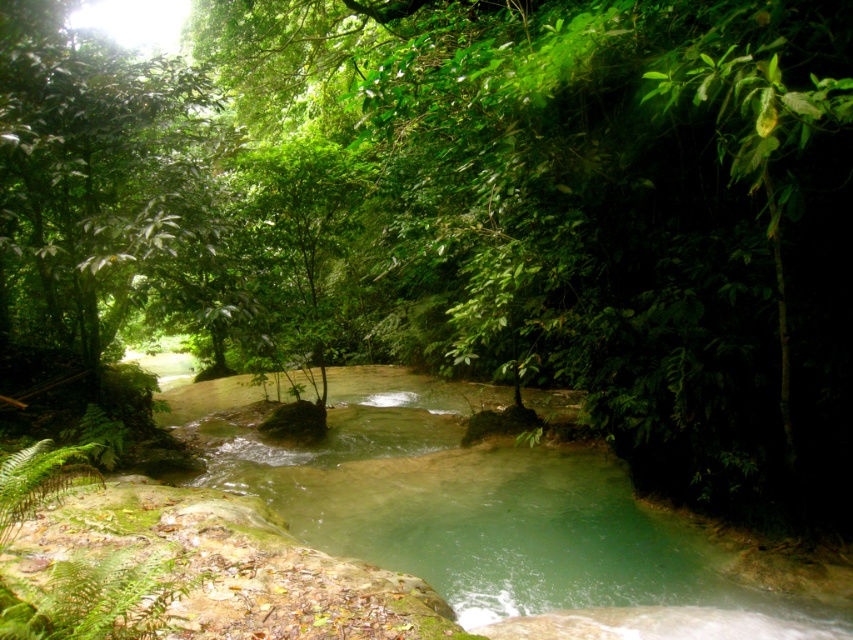
Question: Is clear water at center to the right of green leafy tree at upper left from the viewer's perspective?

Choices:
 (A) yes
 (B) no

Answer: (A)

Question: Which point is farther to the camera?

Choices:
 (A) green leafy tree at upper left
 (B) clear water at center

Answer: (A)

Question: Is clear water at center bigger than green leafy tree at upper left?

Choices:
 (A) yes
 (B) no

Answer: (A)

Question: Which of the following is the closest to the observer?

Choices:
 (A) (115, 129)
 (B) (466, 518)

Answer: (A)

Question: Does clear water at center appear on the left side of green leafy tree at upper left?

Choices:
 (A) yes
 (B) no

Answer: (B)